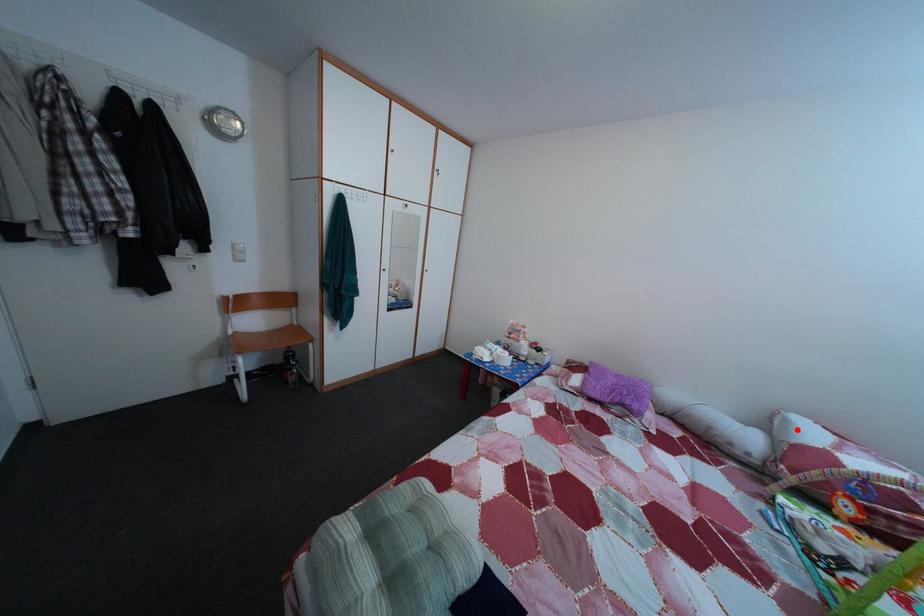
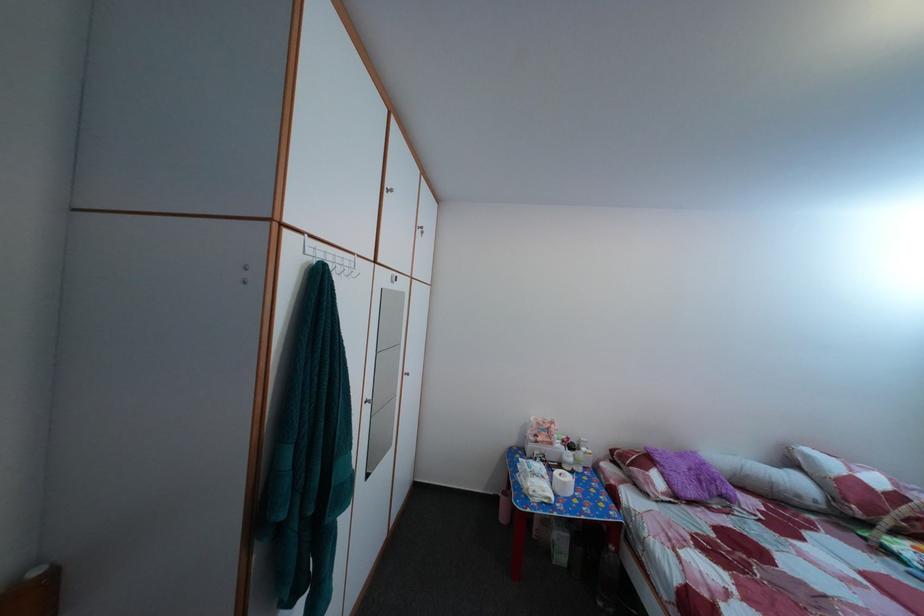
Where in the second image is the point corresponding to the highlighted location from the first image?

(817, 464)